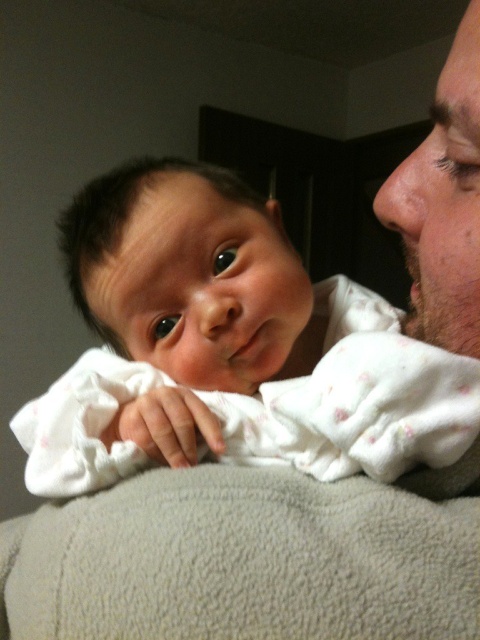
Is white soft fabric baby at center positioned before bearded man at right?

No, it is not.

Is white soft fabric baby at center positioned behind bearded man at right?

Yes, white soft fabric baby at center is further from the viewer.

The height and width of the screenshot is (640, 480). I want to click on white soft fabric baby at center, so click(228, 348).